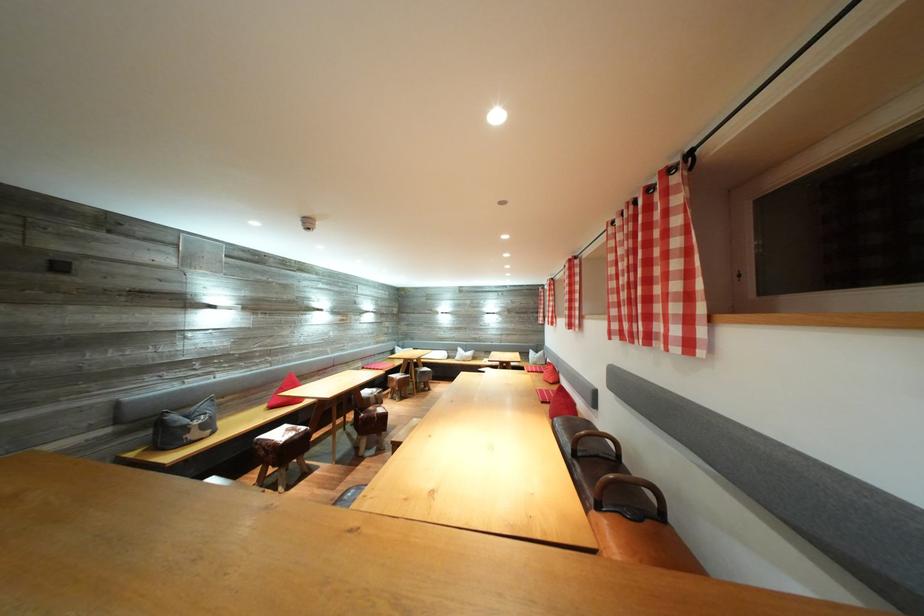
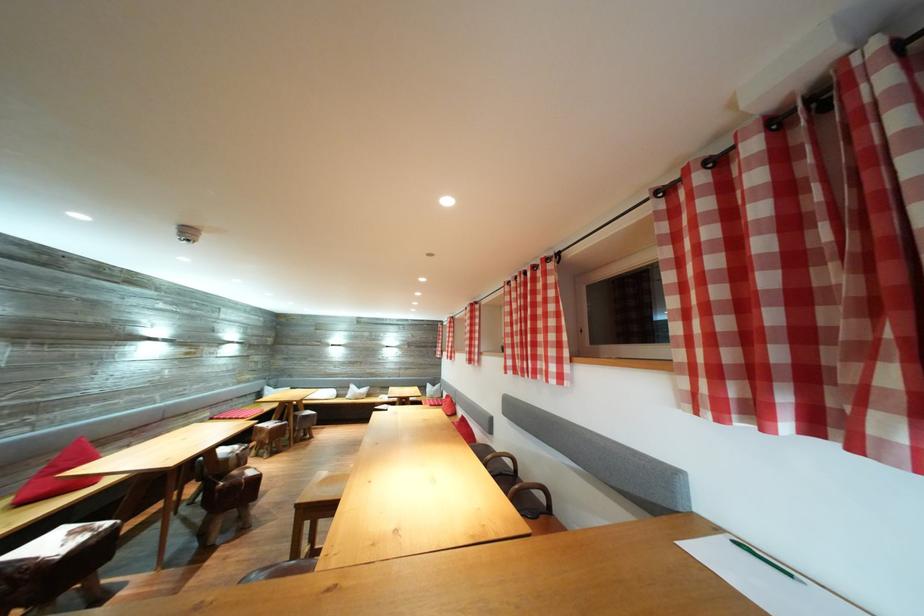
The point at (467,355) is marked in the first image. Where is the corresponding point in the second image?

(359, 392)